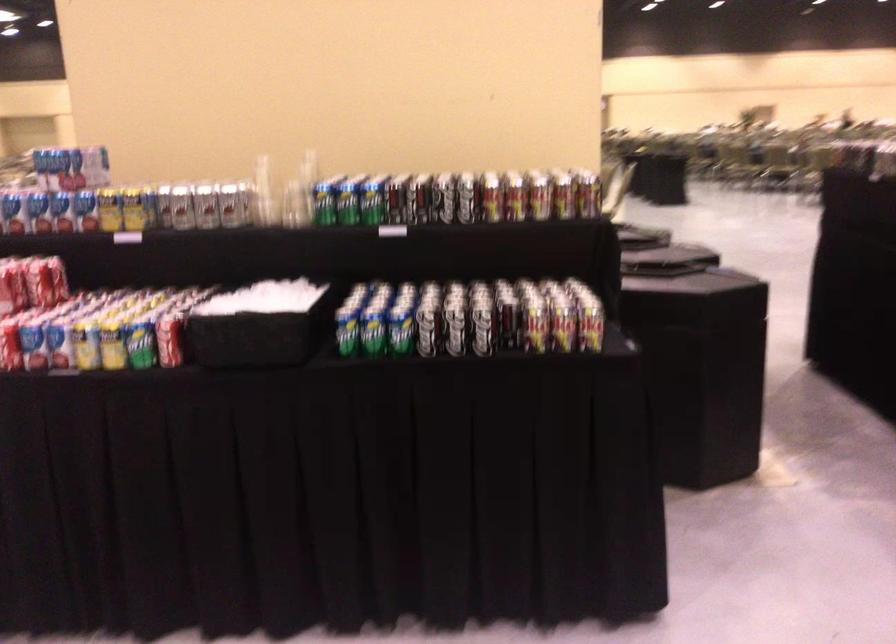
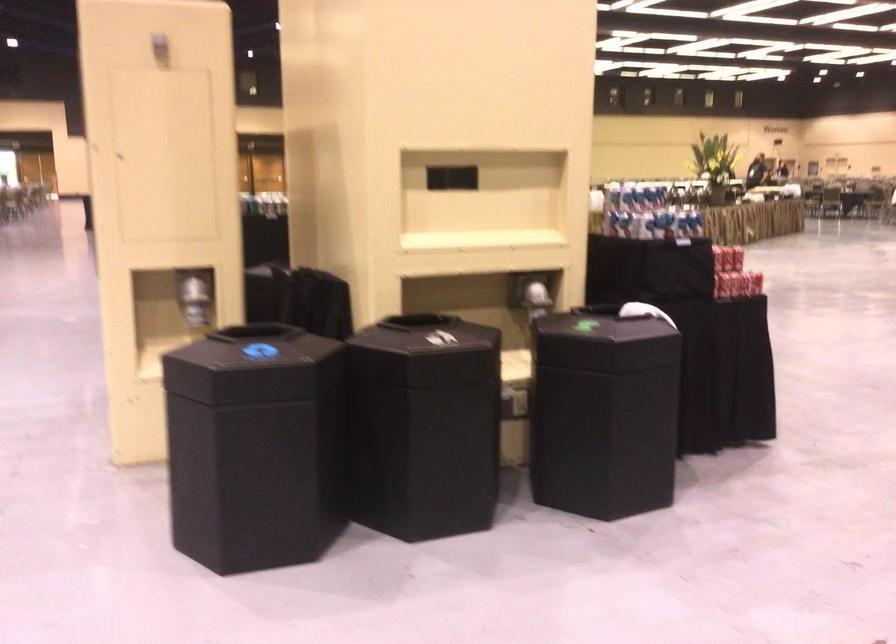
Question: I am providing you with two images of the same scene from different viewpoints. After the viewpoint changes to image2, which objects are now occluded?

Choices:
 (A) yellow mustard bottle
 (B) green soda can
 (C) black bin lid
 (D) shiny dispenser lever

Answer: (B)